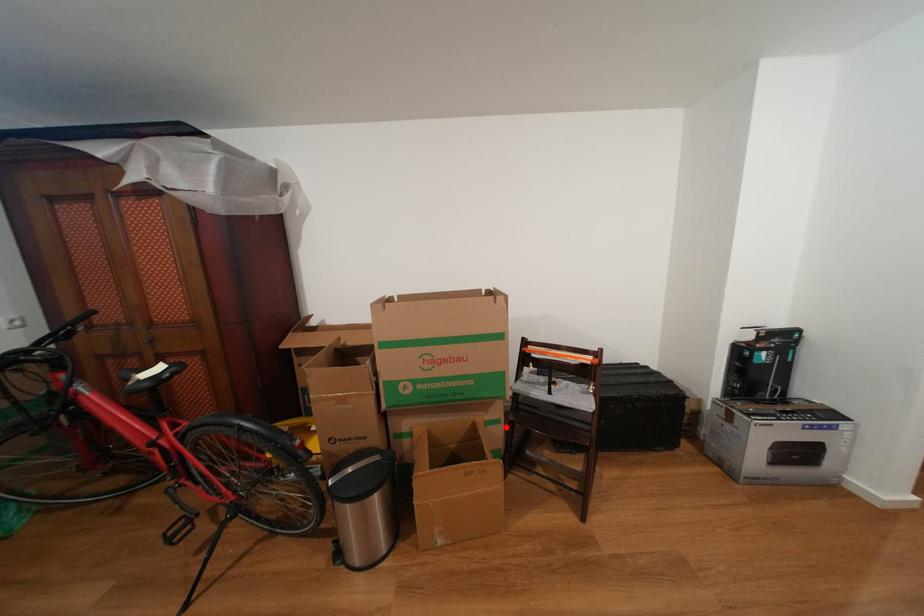
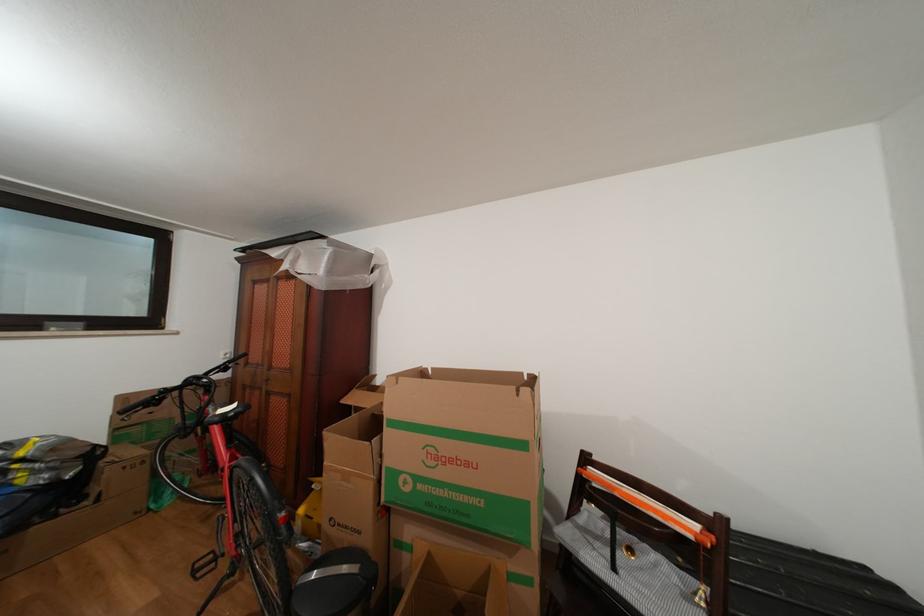
The point at the highlighted location is marked in the first image. Where is the corresponding point in the second image?

(537, 586)